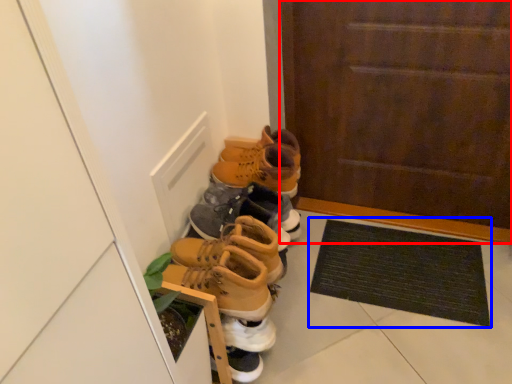
Question: Which object is closer to the camera taking this photo, door (highlighted by a red box) or doormat (highlighted by a blue box)?

Choices:
 (A) door
 (B) doormat

Answer: (A)